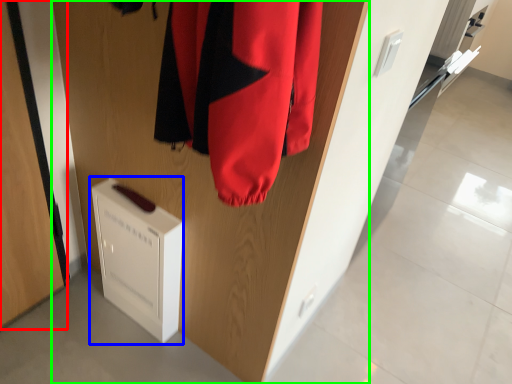
Question: Which object is positioned farthest from door (highlighted by a red box)? Select from appliance (highlighted by a blue box) and door (highlighted by a green box).

Choices:
 (A) appliance
 (B) door

Answer: (B)